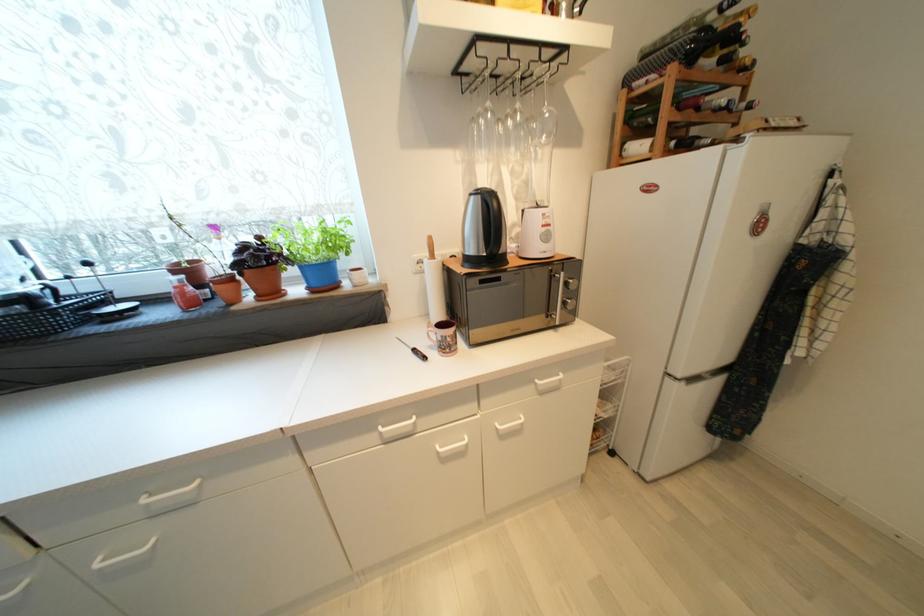
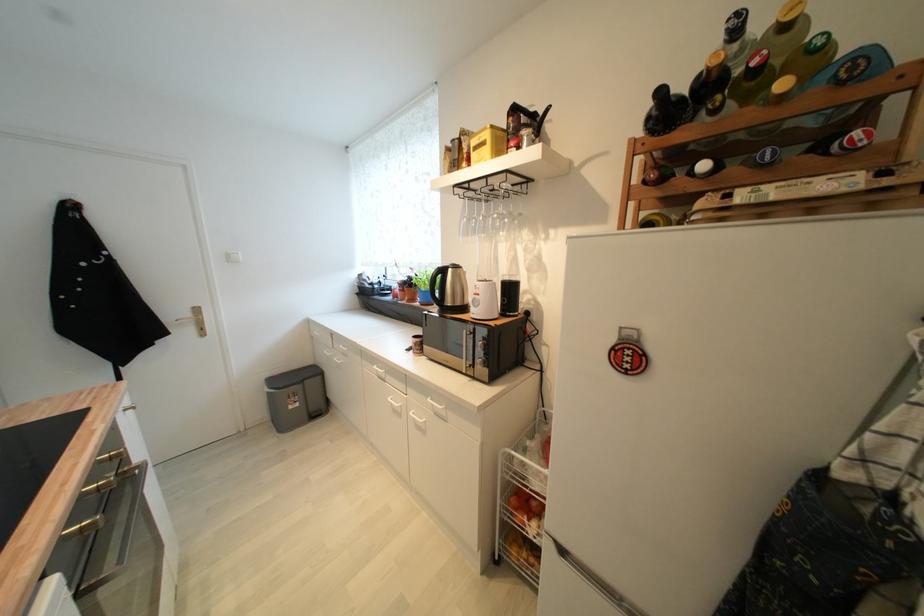
Where in the second image is the point corresponding to (x=563, y=325) from the first image?

(469, 374)